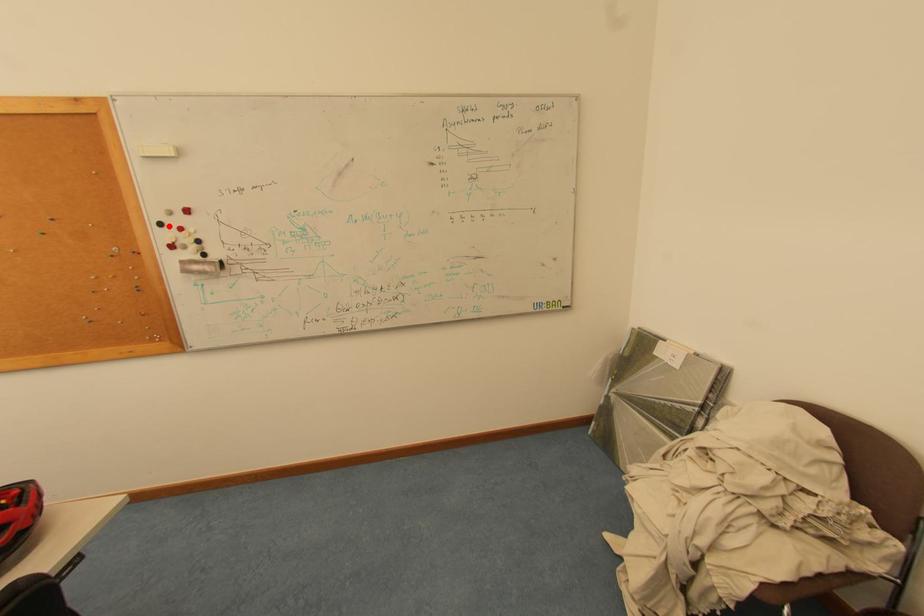
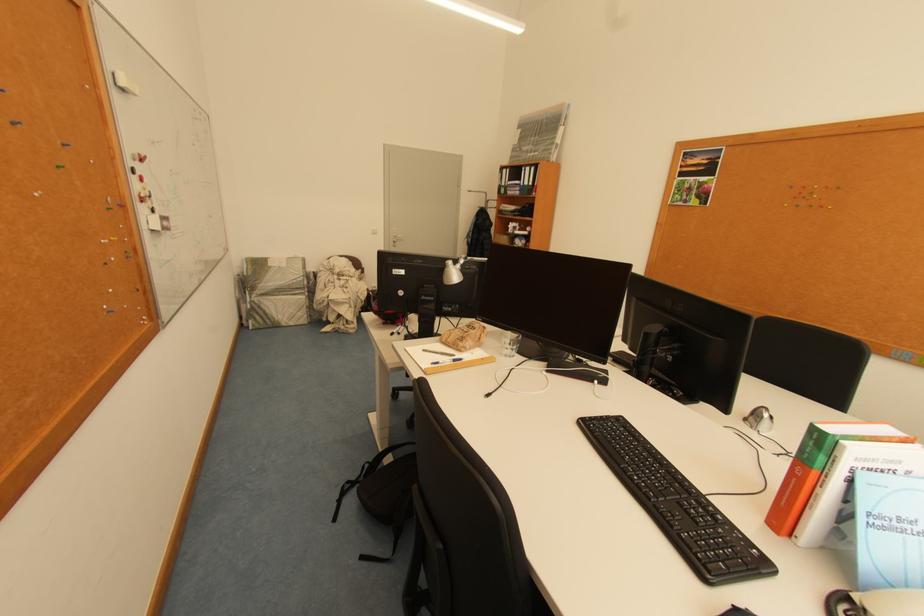
Locate, in the second image, the point that corresponds to the highlighted location in the first image.

(141, 172)